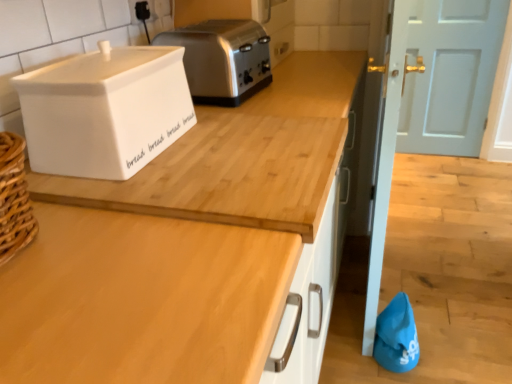
Question: Is satin silver toaster at upper center not within white ceramic bread bin at upper left?

Choices:
 (A) yes
 (B) no

Answer: (A)

Question: Does satin silver toaster at upper center appear on the left side of white ceramic bread bin at upper left?

Choices:
 (A) no
 (B) yes

Answer: (A)

Question: From a real-world perspective, does satin silver toaster at upper center stand above white ceramic bread bin at upper left?

Choices:
 (A) yes
 (B) no

Answer: (B)

Question: Could you tell me if satin silver toaster at upper center is turned towards white ceramic bread bin at upper left?

Choices:
 (A) no
 (B) yes

Answer: (A)

Question: From the image's perspective, is satin silver toaster at upper center above white ceramic bread bin at upper left?

Choices:
 (A) yes
 (B) no

Answer: (A)

Question: In terms of width, does white ceramic bread bin at upper left look wider or thinner when compared to light blue painted wood door at upper right?

Choices:
 (A) thin
 (B) wide

Answer: (B)

Question: Visually, is white ceramic bread bin at upper left positioned to the left or to the right of light blue painted wood door at upper right?

Choices:
 (A) left
 (B) right

Answer: (A)

Question: In the image, is white ceramic bread bin at upper left positioned in front of or behind light blue painted wood door at upper right?

Choices:
 (A) behind
 (B) front

Answer: (B)

Question: In terms of size, does white ceramic bread bin at upper left appear bigger or smaller than light blue painted wood door at upper right?

Choices:
 (A) small
 (B) big

Answer: (A)

Question: Is satin silver toaster at upper center bigger or smaller than white ceramic bread bin at upper left?

Choices:
 (A) small
 (B) big

Answer: (B)

Question: Is satin silver toaster at upper center wider or thinner than white ceramic bread bin at upper left?

Choices:
 (A) wide
 (B) thin

Answer: (A)

Question: Considering the relative positions of satin silver toaster at upper center and white ceramic bread bin at upper left in the image provided, is satin silver toaster at upper center to the left or to the right of white ceramic bread bin at upper left?

Choices:
 (A) left
 (B) right

Answer: (B)

Question: Considering their positions, is satin silver toaster at upper center located in front of or behind white ceramic bread bin at upper left?

Choices:
 (A) front
 (B) behind

Answer: (B)

Question: Which is correct: light blue painted wood door at upper right is inside satin silver toaster at upper center, or outside of it?

Choices:
 (A) inside
 (B) outside

Answer: (B)

Question: In terms of size, does light blue painted wood door at upper right appear bigger or smaller than satin silver toaster at upper center?

Choices:
 (A) small
 (B) big

Answer: (B)